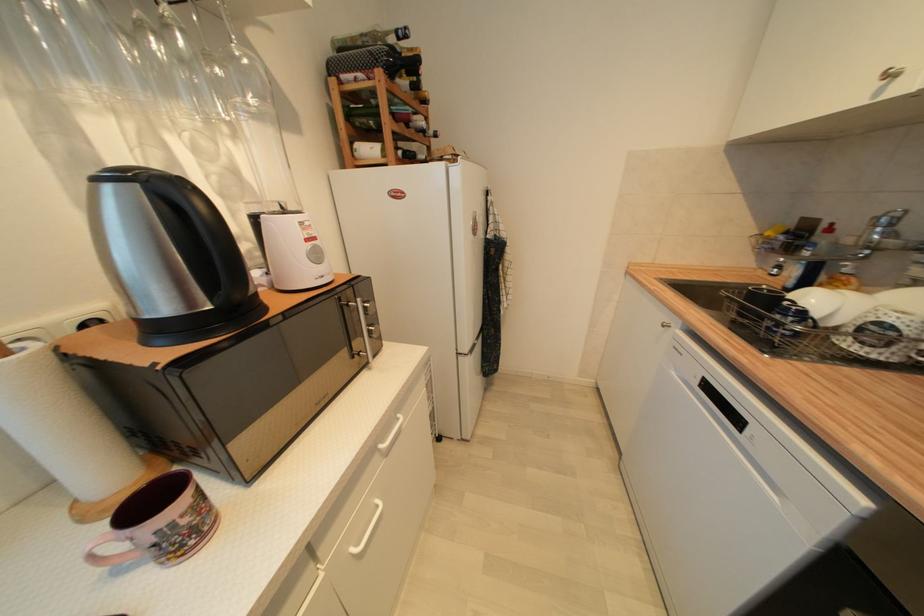
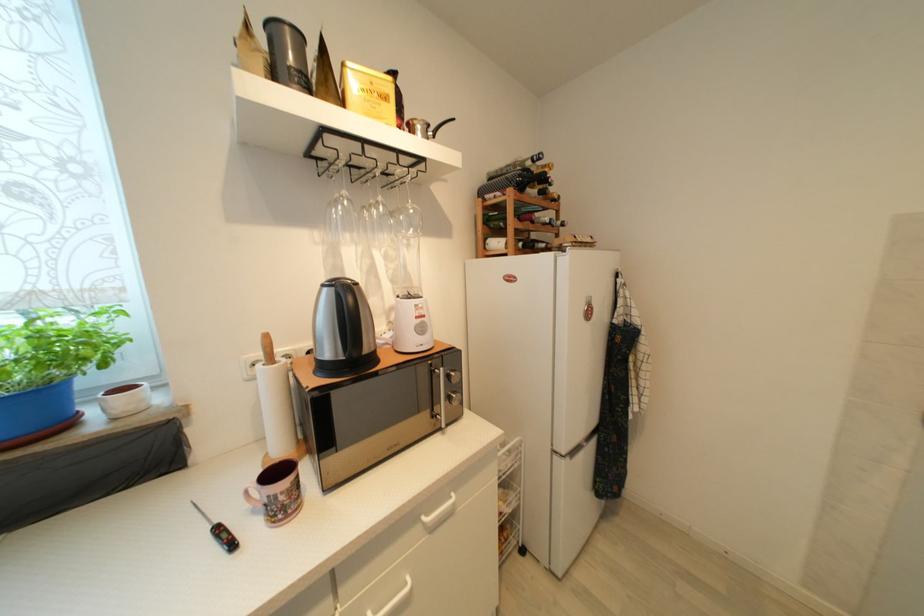
The point at (373, 334) is marked in the first image. Where is the corresponding point in the second image?

(455, 400)